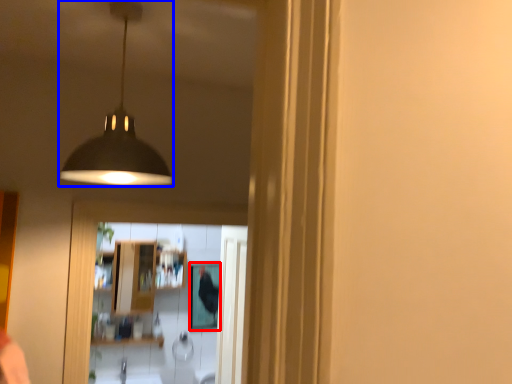
Question: Which object appears closest to the camera in this image, mirror (highlighted by a red box) or lamp (highlighted by a blue box)?

Choices:
 (A) mirror
 (B) lamp

Answer: (B)